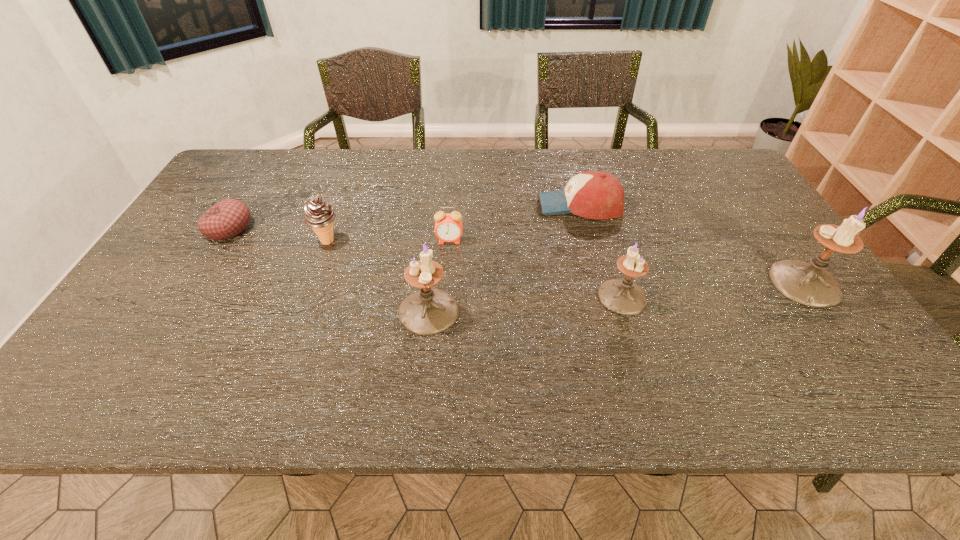
I want to click on the leftmost candle holder, so click(430, 311).

Find the location of a particular element. Image resolution: width=960 pixels, height=540 pixels. the second tallest object is located at coordinates (430, 311).

Where is `the shortest candle holder`? The image size is (960, 540). the shortest candle holder is located at coordinates (622, 296).

Identify the location of the rightmost candle holder. (810, 284).

This screenshot has width=960, height=540. Identify the location of baseball cap. (592, 194).

Identify the location of alarm clock. (448, 227).

I want to click on the second object from left to right, so click(x=319, y=216).

I want to click on the leftmost object, so click(x=228, y=218).

Identify the location of beanbag. (228, 218).

Where is `vacant space located 0.230m on the left of the second tallest object`? Image resolution: width=960 pixels, height=540 pixels. vacant space located 0.230m on the left of the second tallest object is located at coordinates (300, 311).